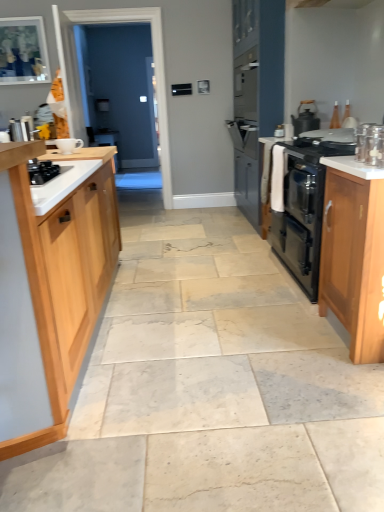
Question: Looking at their shapes, would you say transparent glass door at center is wider or thinner than light wood cabinet at right, marked as the second cabinetry in a left-to-right arrangement?

Choices:
 (A) wide
 (B) thin

Answer: (B)

Question: Is point (92, 105) closer or farther from the camera than point (344, 263)?

Choices:
 (A) farther
 (B) closer

Answer: (A)

Question: Which is nearer to the metallic silver kettle at left, which ranks as the second appliance in right-to-left order?

Choices:
 (A) matte black kettle at upper right, which is the 1th kitchen appliance from top to bottom
 (B) white ceramic cup at upper left, which appears as the first appliance when ordered from the bottom
 (C) black matte oven at right
 (D) light wood cabinet at left, placed as the 2th cabinetry when sorted from right to left
 (E) light wood cabinet at right, which ranks as the 1th cabinetry in right-to-left order

Answer: (B)

Question: Considering the real-world distances, which object is closest to the matte black kettle at upper right, the 2th kitchen appliance from the front?

Choices:
 (A) transparent glass door at center
 (B) black matte gas stove at left
 (C) white ceramic cup at upper left, which ranks as the second appliance in left-to-right order
 (D) white glossy countertop at right
 (E) clear glass jar at upper right, the first kitchen appliance when ordered from bottom to top

Answer: (E)